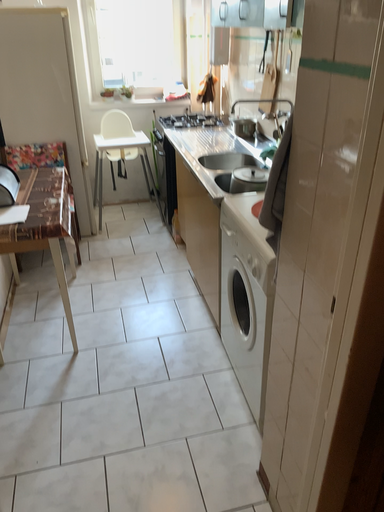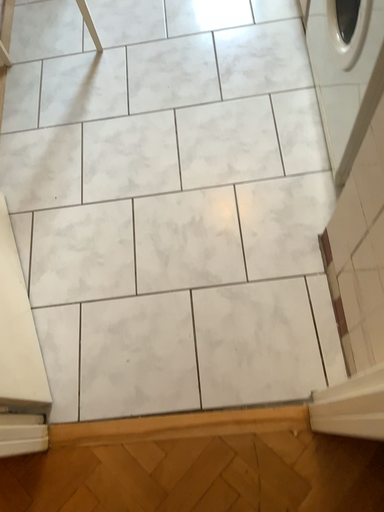
Question: How did the camera likely rotate when shooting the video?

Choices:
 (A) rotated upward
 (B) rotated downward

Answer: (B)